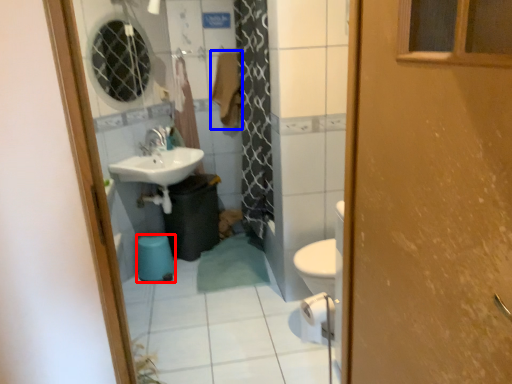
Question: Which object appears farthest to the camera in this image, toilet bowl (highlighted by a red box) or laundry (highlighted by a blue box)?

Choices:
 (A) toilet bowl
 (B) laundry

Answer: (B)